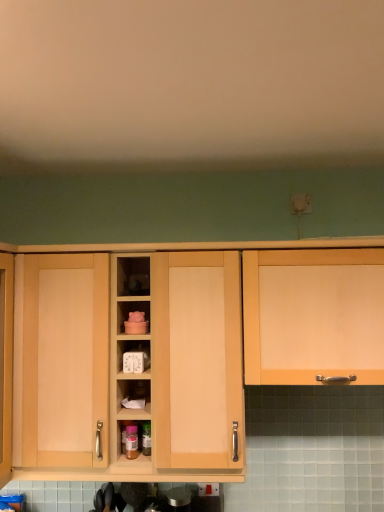
Question: Is light wood cabinet at center, which is the first cabinetry from left to right, wider than white plastic timer at center?

Choices:
 (A) no
 (B) yes

Answer: (B)

Question: Can you confirm if light wood cabinet at center, which is the first cabinetry from left to right, is bigger than white plastic timer at center?

Choices:
 (A) no
 (B) yes

Answer: (B)

Question: From the image's perspective, is light wood cabinet at center, which is counted as the second cabinetry, starting from the right, on top of white plastic timer at center?

Choices:
 (A) yes
 (B) no

Answer: (B)

Question: From a real-world perspective, is light wood cabinet at center, which is the first cabinetry from left to right, on white plastic timer at center?

Choices:
 (A) no
 (B) yes

Answer: (A)

Question: Is light wood cabinet at center, which is counted as the second cabinetry, starting from the right, oriented away from white plastic timer at center?

Choices:
 (A) yes
 (B) no

Answer: (A)

Question: Does light wood cabinet at center, which is the first cabinetry from left to right, have a greater height compared to white plastic timer at center?

Choices:
 (A) no
 (B) yes

Answer: (B)

Question: Is white plastic timer at center looking in the opposite direction of matte wood cabinet at right, positioned as the first cabinetry in right-to-left order?

Choices:
 (A) no
 (B) yes

Answer: (A)

Question: Is white plastic timer at center positioned behind matte wood cabinet at right, placed as the 2th cabinetry when sorted from left to right?

Choices:
 (A) no
 (B) yes

Answer: (B)

Question: Can you see white plastic timer at center touching matte wood cabinet at right, positioned as the first cabinetry in right-to-left order?

Choices:
 (A) no
 (B) yes

Answer: (A)

Question: From the image's perspective, is white plastic timer at center beneath matte wood cabinet at right, placed as the 2th cabinetry when sorted from left to right?

Choices:
 (A) yes
 (B) no

Answer: (A)

Question: Is white plastic timer at center thinner than matte wood cabinet at right, placed as the 2th cabinetry when sorted from left to right?

Choices:
 (A) yes
 (B) no

Answer: (A)

Question: Is white plastic timer at center oriented towards matte wood cabinet at right, placed as the 2th cabinetry when sorted from left to right?

Choices:
 (A) no
 (B) yes

Answer: (A)

Question: Is matte wood cabinet at right, positioned as the first cabinetry in right-to-left order, far away from white plastic timer at center?

Choices:
 (A) no
 (B) yes

Answer: (A)